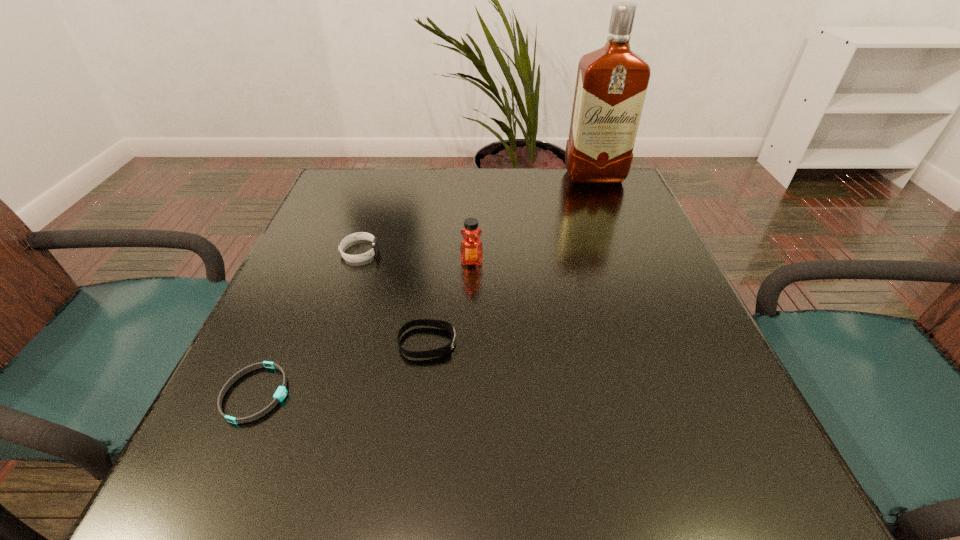
In the image, there is a desktop. At what (x,y) coordinates should I click in order to perform the action: click on vacant space at the left edge. Please return your answer as a coordinate pair (x, y). This screenshot has height=540, width=960. Looking at the image, I should click on (339, 271).

Identify the location of vacant space at the right edge of the desktop. The image size is (960, 540). (655, 436).

Where is `vacant space at the near left corner`? The width and height of the screenshot is (960, 540). vacant space at the near left corner is located at coordinates (295, 476).

At what (x,y) coordinates should I click in order to perform the action: click on free space at the far right corner of the desktop. Please return your answer as a coordinate pair (x, y). Looking at the image, I should click on click(612, 197).

Identify the location of vacant space that is in between the second shortest object and the honey. Image resolution: width=960 pixels, height=540 pixels. (449, 302).

The image size is (960, 540). Find the location of `vacant space in between the second nearest object and the fourth object from left to right`. vacant space in between the second nearest object and the fourth object from left to right is located at coordinates (449, 302).

Locate an element on the screen. Image resolution: width=960 pixels, height=540 pixels. vacant area that lies between the nearest wristband and the third object from right to left is located at coordinates (342, 368).

This screenshot has width=960, height=540. I want to click on free point between the farthest object and the second nearest object, so click(x=511, y=260).

Where is `empty space that is in between the tallest wristband and the nearest wristband`? This screenshot has width=960, height=540. empty space that is in between the tallest wristband and the nearest wristband is located at coordinates (308, 323).

Where is `vacant area that lies between the rightmost wristband and the third shortest object`? vacant area that lies between the rightmost wristband and the third shortest object is located at coordinates click(x=394, y=298).